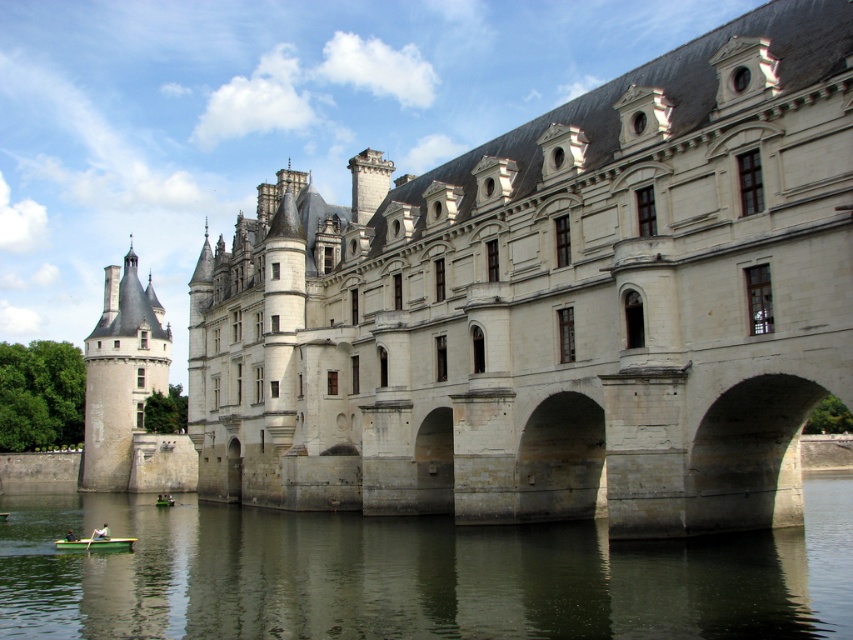
Does green water at lower left appear on the right side of green wooden boat at lower left?

Correct, you'll find green water at lower left to the right of green wooden boat at lower left.

Locate an element on the screen. Image resolution: width=853 pixels, height=640 pixels. green water at lower left is located at coordinates (415, 573).

Is the position of green water at lower left more distant than that of green wood paddle at lower left?

No.

Who is more distant from viewer, (x=47, y=579) or (x=86, y=548)?

Point (x=86, y=548)

The image size is (853, 640). What are the coordinates of `green water at lower left` in the screenshot? It's located at (415, 573).

How distant is green water at lower left from green fabric boat at lower left?

green water at lower left is 19.28 meters away from green fabric boat at lower left.

Can you confirm if green water at lower left is positioned to the right of green fabric boat at lower left?

Yes, green water at lower left is to the right of green fabric boat at lower left.

What do you see at coordinates (415, 573) in the screenshot?
I see `green water at lower left` at bounding box center [415, 573].

Image resolution: width=853 pixels, height=640 pixels. I want to click on green water at lower left, so click(415, 573).